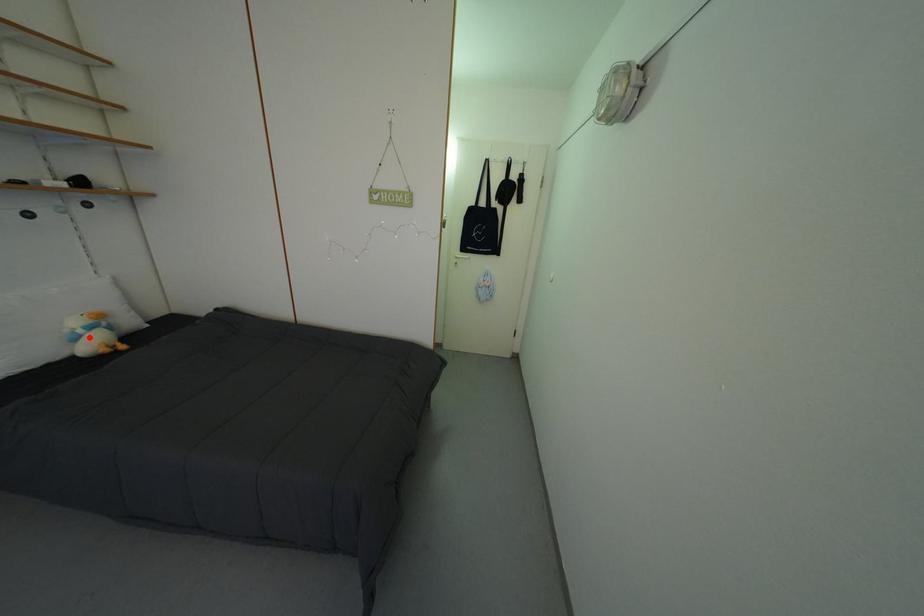
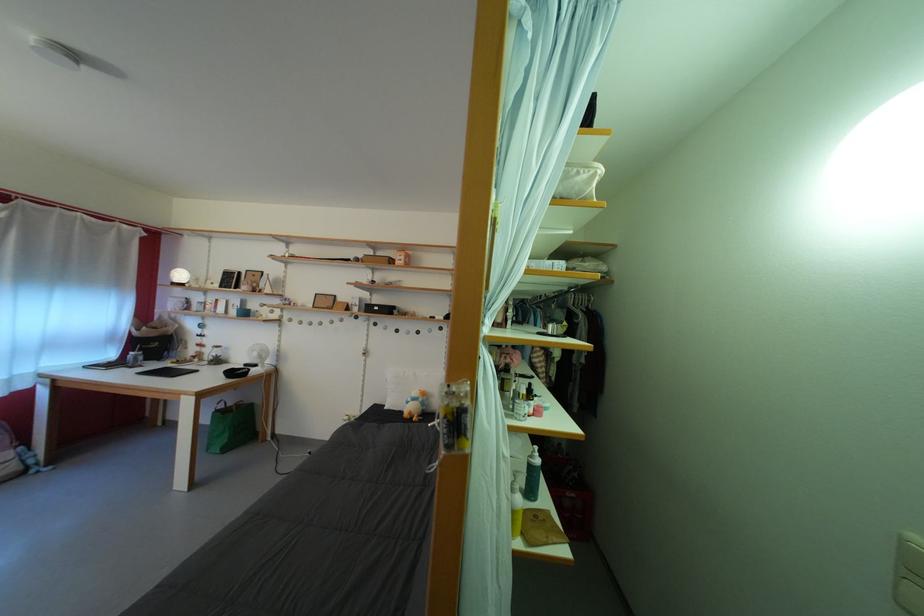
Where in the second image is the point corresponding to the highlighted location from the first image?

(418, 405)